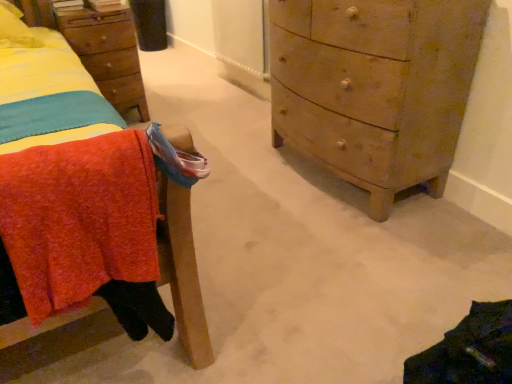
In order to click on wooden chest of drawers at right in this screenshot , I will do `click(375, 87)`.

Where is `wooden nightstand at upper left`? This screenshot has width=512, height=384. wooden nightstand at upper left is located at coordinates [108, 54].

This screenshot has width=512, height=384. In order to click on knitted wool blanket at left in this screenshot , I will do `click(82, 193)`.

Would you consider wooden chest of drawers at right to be distant from knitted wool blanket at left?

Yes, wooden chest of drawers at right is far from knitted wool blanket at left.

Based on the photo, is wooden chest of drawers at right situated inside knitted wool blanket at left or outside?

wooden chest of drawers at right lies outside knitted wool blanket at left.

Find the location of a particular element. the chest of drawers lying behind the knitted wool blanket at left is located at coordinates (375, 87).

Between wooden chest of drawers at right and knitted wool blanket at left, which one appears on the left side from the viewer's perspective?

Positioned to the left is knitted wool blanket at left.

Is knitted wool blanket at left facing away from wooden nightstand at upper left?

Yes.

Who is smaller, knitted wool blanket at left or wooden nightstand at upper left?

Smaller between the two is knitted wool blanket at left.

Looking at their sizes, would you say knitted wool blanket at left is wider or thinner than wooden nightstand at upper left?

In the image, knitted wool blanket at left appears to be more narrow than wooden nightstand at upper left.

From the image's perspective, is knitted wool blanket at left located above or below wooden nightstand at upper left?

Clearly, from the image's perspective, knitted wool blanket at left is below wooden nightstand at upper left.

From a real-world perspective, who is located higher, wooden nightstand at upper left or knitted wool blanket at left?

From a 3D spatial view, knitted wool blanket at left is above.

Which of these two, wooden nightstand at upper left or knitted wool blanket at left, is bigger?

wooden nightstand at upper left is bigger.

Between wooden nightstand at upper left and knitted wool blanket at left, which one has more height?

With more height is wooden nightstand at upper left.

From the image's perspective, which one is positioned higher, wooden chest of drawers at right or wooden nightstand at upper left?

wooden nightstand at upper left.

Is wooden chest of drawers at right to the left of wooden nightstand at upper left from the viewer's perspective?

In fact, wooden chest of drawers at right is to the right of wooden nightstand at upper left.

In terms of width, does wooden chest of drawers at right look wider or thinner when compared to wooden nightstand at upper left?

Considering their sizes, wooden chest of drawers at right looks broader than wooden nightstand at upper left.

In terms of height, does wooden nightstand at upper left look taller or shorter compared to wooden chest of drawers at right?

Clearly, wooden nightstand at upper left is shorter compared to wooden chest of drawers at right.

From the image's perspective, is wooden nightstand at upper left located above or below wooden chest of drawers at right?

wooden nightstand at upper left is situated higher than wooden chest of drawers at right in the image.

Is wooden chest of drawers at right at the back of wooden nightstand at upper left?

wooden nightstand at upper left is not turned away from wooden chest of drawers at right.

Is wooden nightstand at upper left not within wooden chest of drawers at right?

Absolutely, wooden nightstand at upper left is external to wooden chest of drawers at right.

Considering the relative positions of knitted wool blanket at left and wooden chest of drawers at right in the image provided, is knitted wool blanket at left behind wooden chest of drawers at right?

That is False.

From a real-world perspective, is knitted wool blanket at left physically located above or below wooden chest of drawers at right?

knitted wool blanket at left is above wooden chest of drawers at right.

Can you tell me how much knitted wool blanket at left and wooden chest of drawers at right differ in facing direction?

There is a 90.2-degree angle between the facing directions of knitted wool blanket at left and wooden chest of drawers at right.

Considering the relative positions of knitted wool blanket at left and wooden chest of drawers at right in the image provided, is knitted wool blanket at left to the right of wooden chest of drawers at right from the viewer's perspective?

No, knitted wool blanket at left is not to the right of wooden chest of drawers at right.

At what (x,y) coordinates should I click in order to perform the action: click on the chest of drawers above the knitted wool blanket at left (from the image's perspective). Please return your answer as a coordinate pair (x, y). This screenshot has height=384, width=512. Looking at the image, I should click on (375, 87).

The height and width of the screenshot is (384, 512). Identify the location of furniture above the wooden nightstand at upper left (from a real-world perspective). (82, 193).

Consider the image. Looking at the image, which one is located closer to knitted wool blanket at left, wooden nightstand at upper left or wooden chest of drawers at right?

wooden nightstand at upper left is closer to knitted wool blanket at left.

Based on their spatial positions, is knitted wool blanket at left or wooden nightstand at upper left closer to wooden chest of drawers at right?

knitted wool blanket at left is closer to wooden chest of drawers at right.

Estimate the real-world distances between objects in this image. Which object is closer to knitted wool blanket at left, wooden chest of drawers at right or wooden nightstand at upper left?

wooden nightstand at upper left is positioned closer to the anchor knitted wool blanket at left.

When comparing their distances from wooden nightstand at upper left, does wooden chest of drawers at right or knitted wool blanket at left seem further?

wooden chest of drawers at right is further to wooden nightstand at upper left.

Considering their positions, is knitted wool blanket at left positioned further to wooden nightstand at upper left than wooden chest of drawers at right?

wooden chest of drawers at right is further to wooden nightstand at upper left.

Which object lies nearer to the anchor point wooden chest of drawers at right, wooden nightstand at upper left or knitted wool blanket at left?

Among the two, knitted wool blanket at left is located nearer to wooden chest of drawers at right.

Where is `the chest of drawers located between knitted wool blanket at left and wooden nightstand at upper left in the depth direction`? The height and width of the screenshot is (384, 512). the chest of drawers located between knitted wool blanket at left and wooden nightstand at upper left in the depth direction is located at coordinates (375, 87).